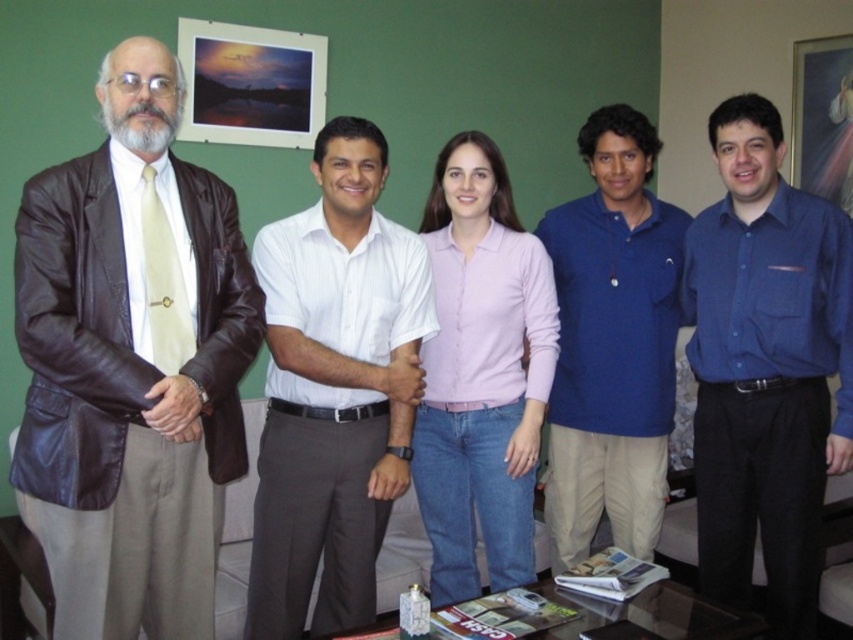
From the picture: Is white cotton shirt at center bigger than pink cotton shirt at center?

Indeed, white cotton shirt at center has a larger size compared to pink cotton shirt at center.

Who is lower down, white cotton shirt at center or pink cotton shirt at center?

Positioned lower is white cotton shirt at center.

The image size is (853, 640). What do you see at coordinates (334, 388) in the screenshot?
I see `white cotton shirt at center` at bounding box center [334, 388].

Where is `white cotton shirt at center`? white cotton shirt at center is located at coordinates (334, 388).

Which is below, brown leather jacket at left or blue cotton polo shirt at center?

Positioned lower is blue cotton polo shirt at center.

Where is `brown leather jacket at left`? brown leather jacket at left is located at coordinates (131, 364).

Is white cotton shirt at center closer to camera compared to blue cotton polo shirt at center?

Yes, white cotton shirt at center is closer to the viewer.

Is point (271, 534) more distant than point (579, 326)?

No, it is not.

Locate an element on the screen. Image resolution: width=853 pixels, height=640 pixels. white cotton shirt at center is located at coordinates pos(334,388).